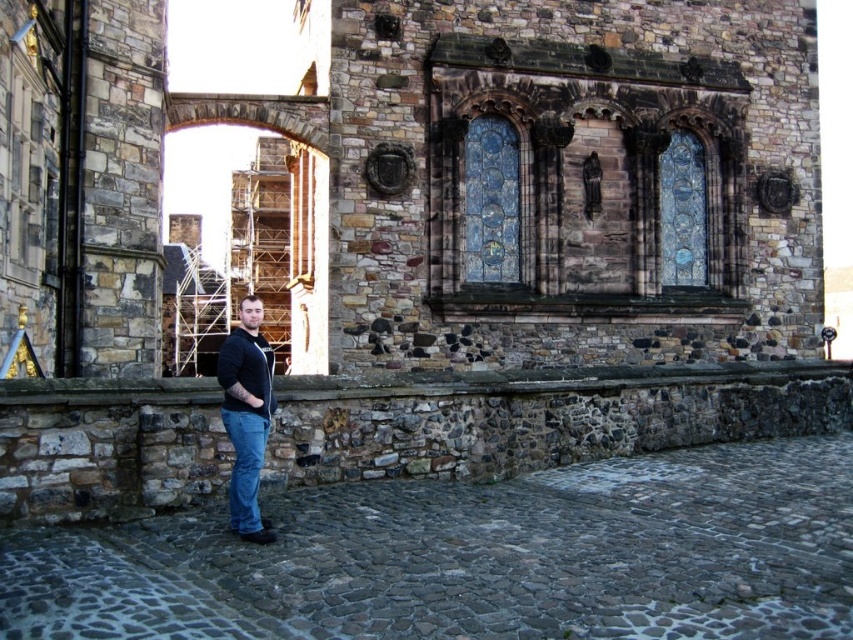
You are an observer standing in front of the historic stone structure. You notice two items in the scene. Which one is positioned higher up between the black matte jacket at center and the black matte shirt at lower center?

The black matte jacket at center is positioned higher up than the black matte shirt at lower center.

You are a fashion designer observing a model wearing the black matte jacket at center and denim at lower center. Which item of clothing takes up more space on the model?

The black matte jacket at center is larger in size than the denim at lower center, so it takes up more space on the model.